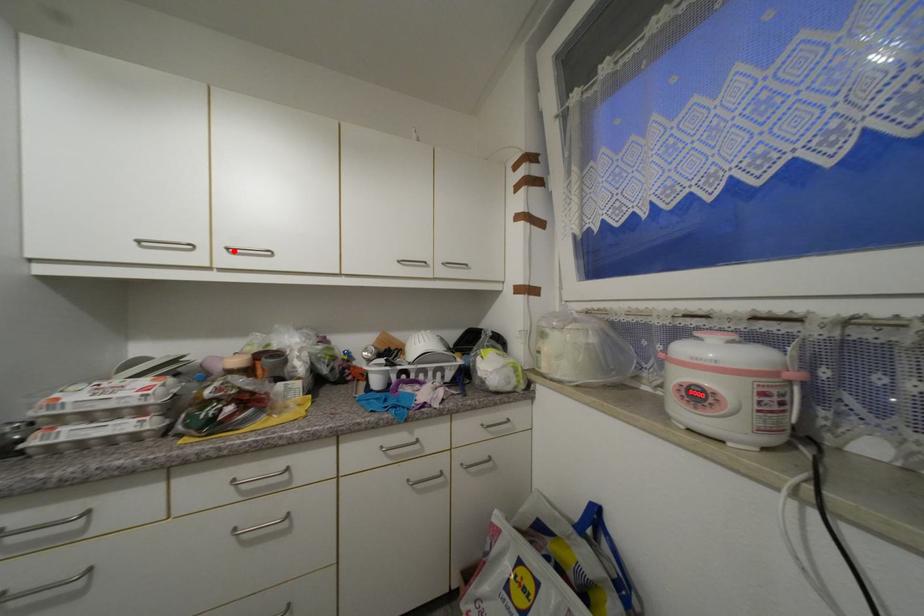
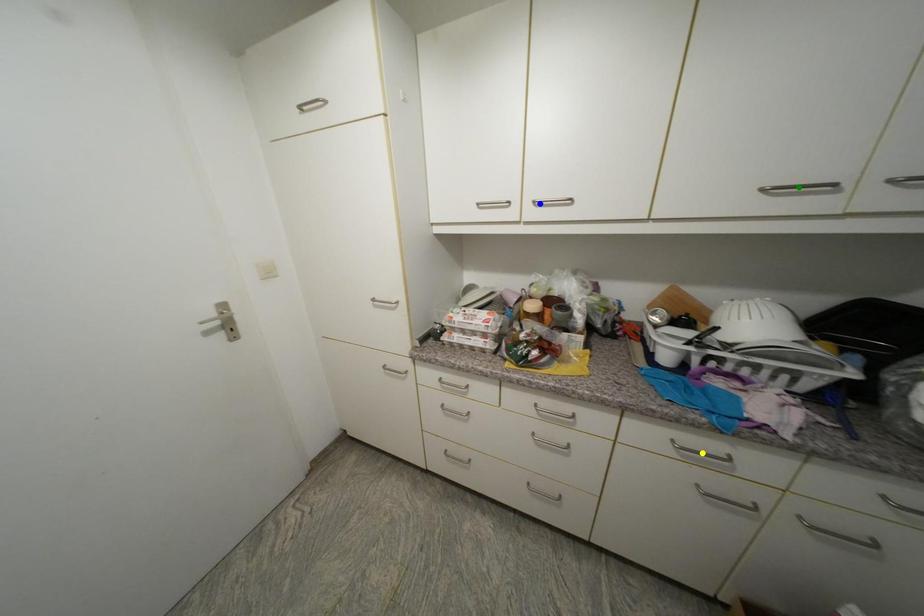
Question: I am providing you with two images of the same scene from different viewpoints. A red point is marked on the first image. You are given multiple points on the second image. Can you choose the point in image 2 that corresponds to the point in image 1?

Choices:
 (A) blue point
 (B) yellow point
 (C) green point

Answer: (A)